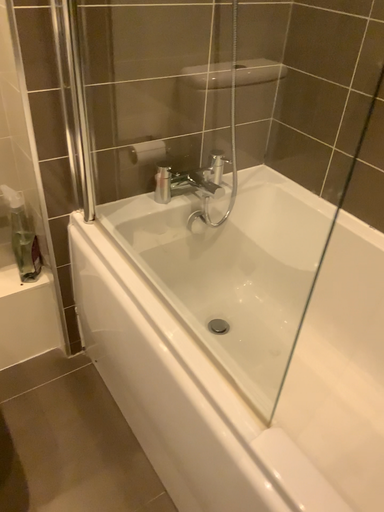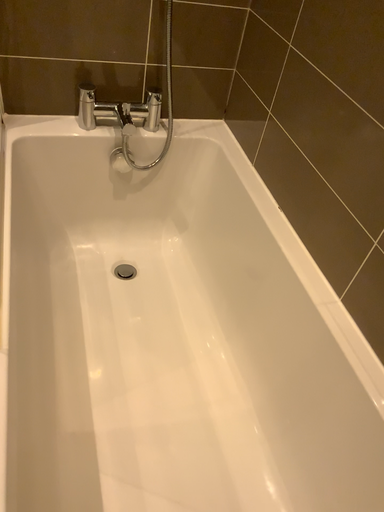
Question: Which way did the camera rotate in the video?

Choices:
 (A) rotated left
 (B) rotated right

Answer: (A)